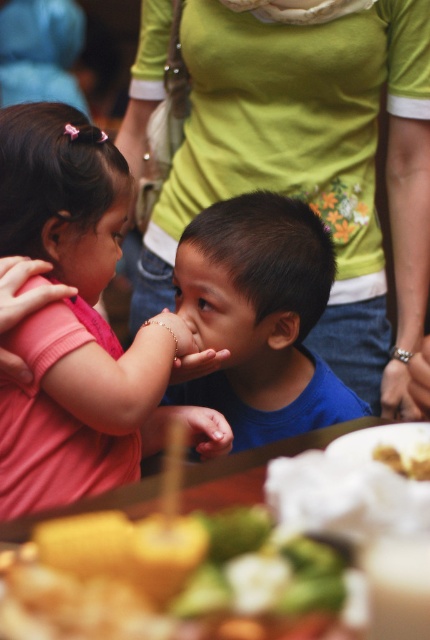
You are standing at the center of the image and want to move towards the point labeled as point (248, 605). However, there is an obstacle at point (417, 468). Will you encounter the obstacle before reaching your destination?

Point (248, 605) is in front of point (417, 468), so you will reach the destination before encountering the obstacle.

You are a child at a picnic and see both the smooth yellow bread at lower left and the yellow crumbly bread at lower right. Which bread is closer to your left hand if you are sitting in between them?

The smooth yellow bread at lower left is closer to your left hand since it is positioned on the left side of the yellow crumbly bread at lower right.

You are a photographer at the event and want to capture a closeup of the green fabric shirt at center without the yellow crumbly bread at lower right appearing in the frame. Is the shirt wide enough to be framed without including the bread?

The green fabric shirt at center is wider than the yellow crumbly bread at lower right, so it is possible to frame the shirt without including the bread in the photo.